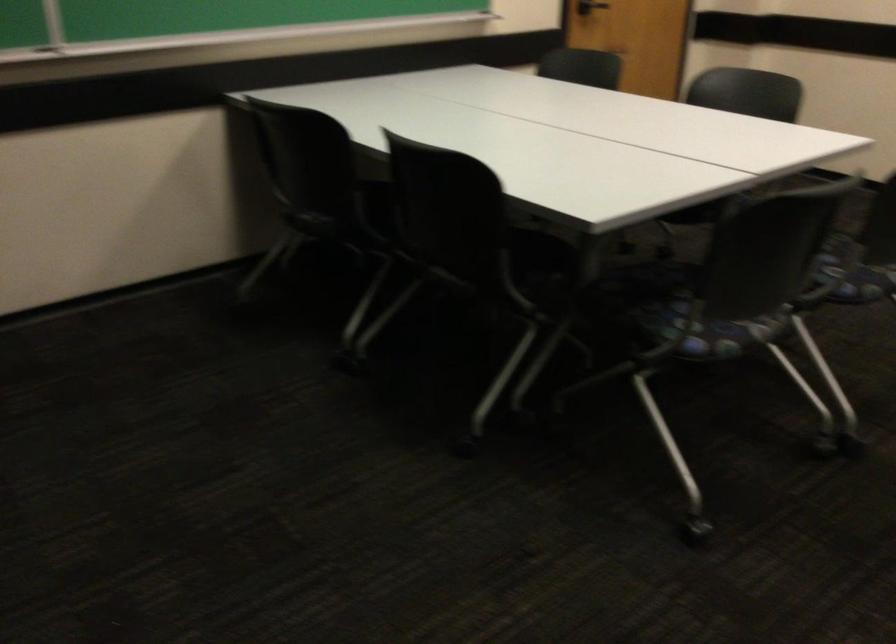
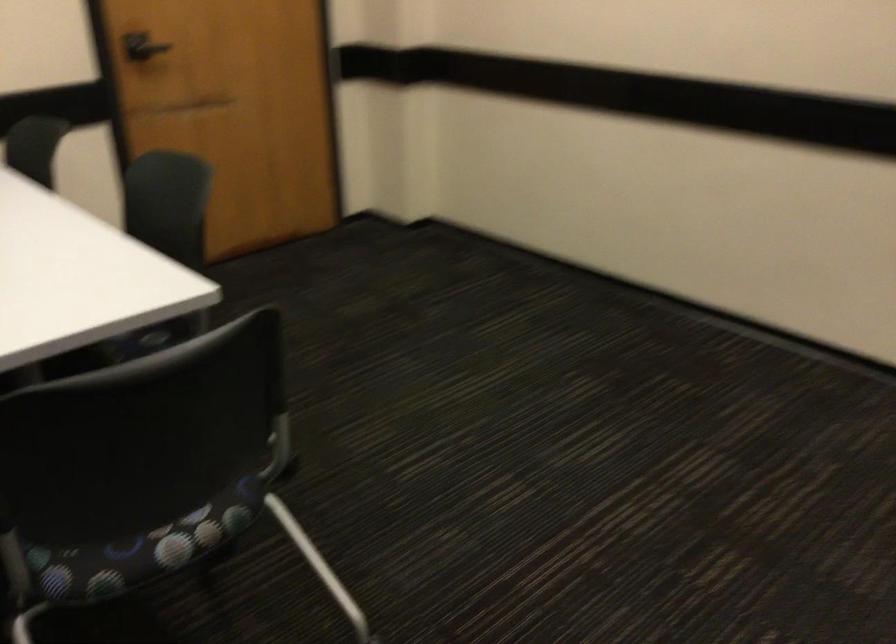
Which direction would the cameraman need to move to produce the second image?

The cameraman moved toward right, forward.